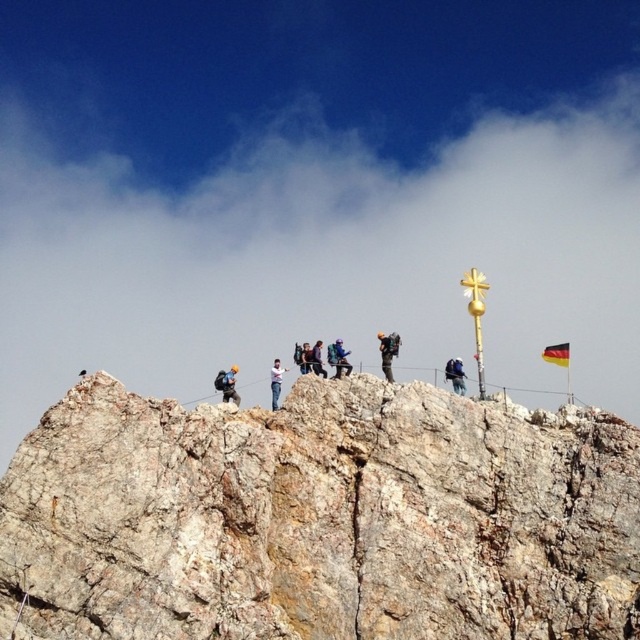
Question: Which object appears closest to the camera in this image?

Choices:
 (A) blue fabric jacket at center
 (B) dark blue fabric jacket at center
 (C) matte black backpack at center

Answer: (A)

Question: Estimate the real-world distances between objects in this image. Which object is closer to the gray rough rock at center?

Choices:
 (A) matte black backpack at center
 (B) dark blue fabric jacket at center
 (C) light blue fabric jacket at center

Answer: (A)

Question: Which object is the closest to the blue fabric backpack at center?

Choices:
 (A) matte black backpack at center
 (B) dark blue jacket at center
 (C) dark blue fabric jacket at center

Answer: (C)

Question: Is matte black backpack at center above light blue fabric backpack at center?

Choices:
 (A) no
 (B) yes

Answer: (B)

Question: Observing the image, what is the correct spatial positioning of light blue fabric jacket at center in reference to dark blue fabric jacket at center?

Choices:
 (A) left
 (B) right

Answer: (A)

Question: Considering the relative positions of matte black backpack at center and light blue fabric jacket at center in the image provided, where is matte black backpack at center located with respect to light blue fabric jacket at center?

Choices:
 (A) right
 (B) left

Answer: (A)